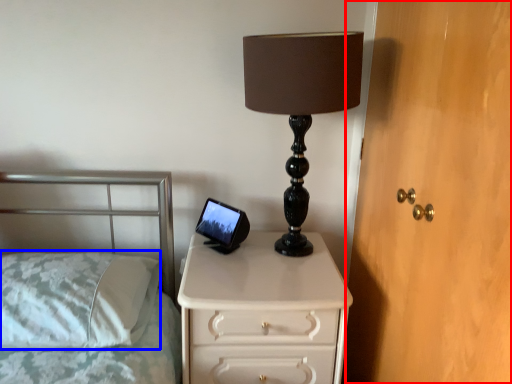
Question: Which point is closer to the camera, dresser (highlighted by a red box) or pillow (highlighted by a blue box)?

Choices:
 (A) dresser
 (B) pillow

Answer: (A)